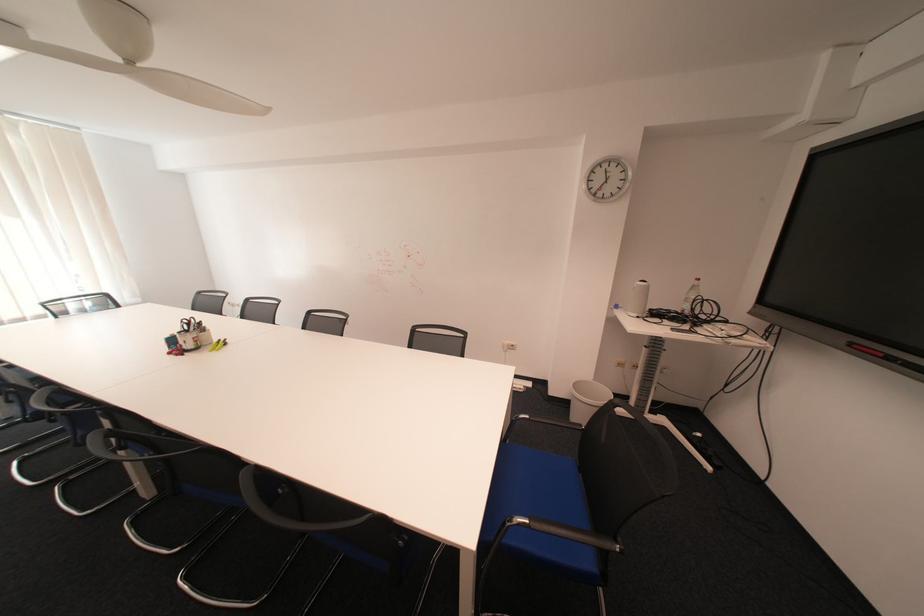
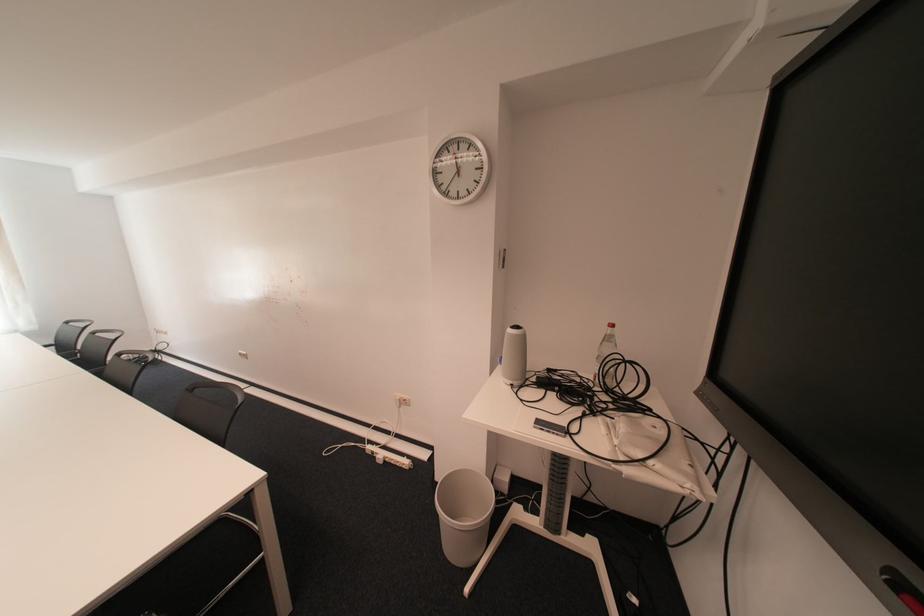
In the second image, find the point that corresponds to point (647, 315) in the first image.

(520, 383)